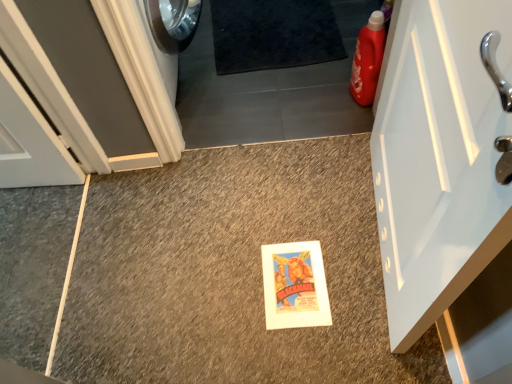
Question: Considering the relative sizes of white glossy door at right, positioned as the 1th door in right-to-left order, and black shaggy carpet at upper center in the image provided, is white glossy door at right, positioned as the 1th door in right-to-left order, shorter than black shaggy carpet at upper center?

Choices:
 (A) yes
 (B) no

Answer: (B)

Question: Would you say white glossy door at right, which is counted as the 2th door, starting from the left, contains black shaggy carpet at upper center?

Choices:
 (A) no
 (B) yes

Answer: (A)

Question: Considering the relative sizes of white glossy door at right, which is counted as the 2th door, starting from the left, and black shaggy carpet at upper center in the image provided, is white glossy door at right, which is counted as the 2th door, starting from the left, taller than black shaggy carpet at upper center?

Choices:
 (A) yes
 (B) no

Answer: (A)

Question: Is white glossy door at right, which is counted as the 2th door, starting from the left, directly adjacent to black shaggy carpet at upper center?

Choices:
 (A) no
 (B) yes

Answer: (A)

Question: Is the depth of white glossy door at right, which is counted as the 2th door, starting from the left, greater than that of black shaggy carpet at upper center?

Choices:
 (A) no
 (B) yes

Answer: (A)

Question: Is black shaggy carpet at upper center at the back of white glossy door at right, positioned as the 1th door in right-to-left order?

Choices:
 (A) no
 (B) yes

Answer: (A)

Question: Is black shaggy carpet at upper center outside white glossy door at right, which is counted as the 2th door, starting from the left?

Choices:
 (A) yes
 (B) no

Answer: (A)

Question: From the image's perspective, is black shaggy carpet at upper center under white glossy door at right, positioned as the 1th door in right-to-left order?

Choices:
 (A) no
 (B) yes

Answer: (A)

Question: Could you tell me if black shaggy carpet at upper center is facing white glossy door at right, positioned as the 1th door in right-to-left order?

Choices:
 (A) yes
 (B) no

Answer: (B)

Question: Is black shaggy carpet at upper center surrounding white glossy door at right, positioned as the 1th door in right-to-left order?

Choices:
 (A) no
 (B) yes

Answer: (A)

Question: Is black shaggy carpet at upper center taller than white glossy door at right, positioned as the 1th door in right-to-left order?

Choices:
 (A) yes
 (B) no

Answer: (B)

Question: Is black shaggy carpet at upper center oriented away from white glossy door at right, which is counted as the 2th door, starting from the left?

Choices:
 (A) no
 (B) yes

Answer: (A)

Question: Is black shaggy carpet at upper center outside of white painted wood door at left, the first door positioned from the left?

Choices:
 (A) no
 (B) yes

Answer: (B)